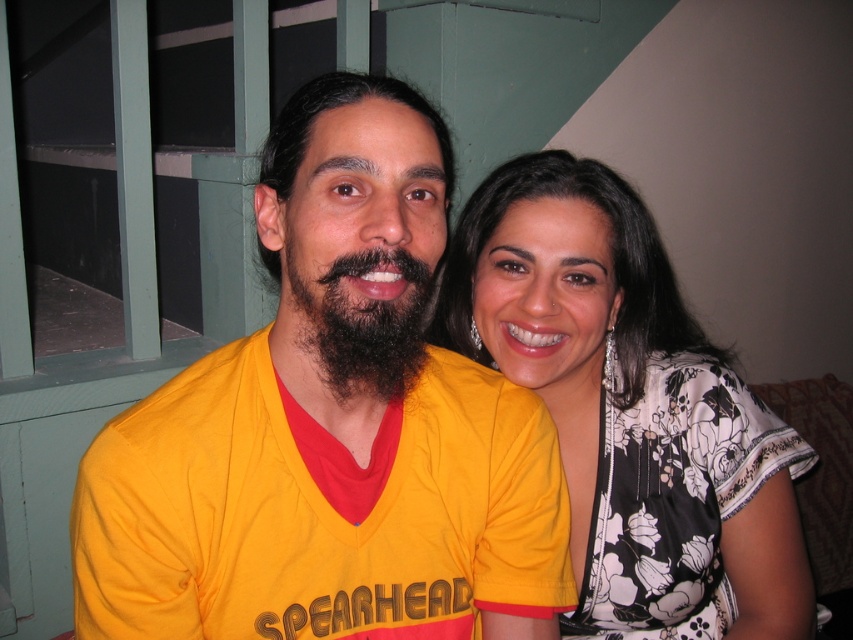
Is white floral blouse at upper right smaller than dark brown curly beard at center?

Actually, white floral blouse at upper right might be larger than dark brown curly beard at center.

Is white floral blouse at upper right closer to the viewer compared to dark brown curly beard at center?

No, white floral blouse at upper right is further to the viewer.

Does point (543, 321) lie in front of point (396, 317)?

No, (543, 321) is behind (396, 317).

Where is `white floral blouse at upper right`? The width and height of the screenshot is (853, 640). white floral blouse at upper right is located at coordinates (628, 406).

Is the position of yellow fabric shirt at center less distant than that of dark brown curly beard at center?

Yes, it is.

Who is shorter, yellow fabric shirt at center or dark brown curly beard at center?

dark brown curly beard at center

Who is more distant from viewer, (358, 340) or (370, 250)?

Positioned behind is point (358, 340).

You are a GUI agent. You are given a task and a screenshot of the screen. Output one action in this format:
    pyautogui.click(x=<x>, y=<y>)
    Task: Click on the yellow fabric shirt at center
    This screenshot has height=640, width=853.
    Given the screenshot: What is the action you would take?
    pyautogui.click(x=331, y=428)

Is yellow fabric shirt at center below white floral blouse at upper right?

No, yellow fabric shirt at center is not below white floral blouse at upper right.

In the scene shown: Between yellow fabric shirt at center and white floral blouse at upper right, which one appears on the right side from the viewer's perspective?

white floral blouse at upper right

Describe the element at coordinates (331, 428) in the screenshot. I see `yellow fabric shirt at center` at that location.

The image size is (853, 640). In order to click on yellow fabric shirt at center in this screenshot , I will do `click(331, 428)`.